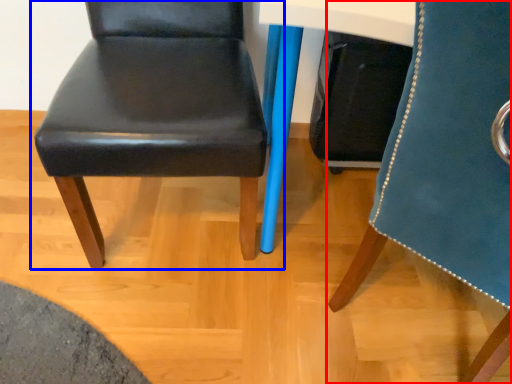
Question: Which object is closer to the camera taking this photo, chair (highlighted by a red box) or chair (highlighted by a blue box)?

Choices:
 (A) chair
 (B) chair

Answer: (A)